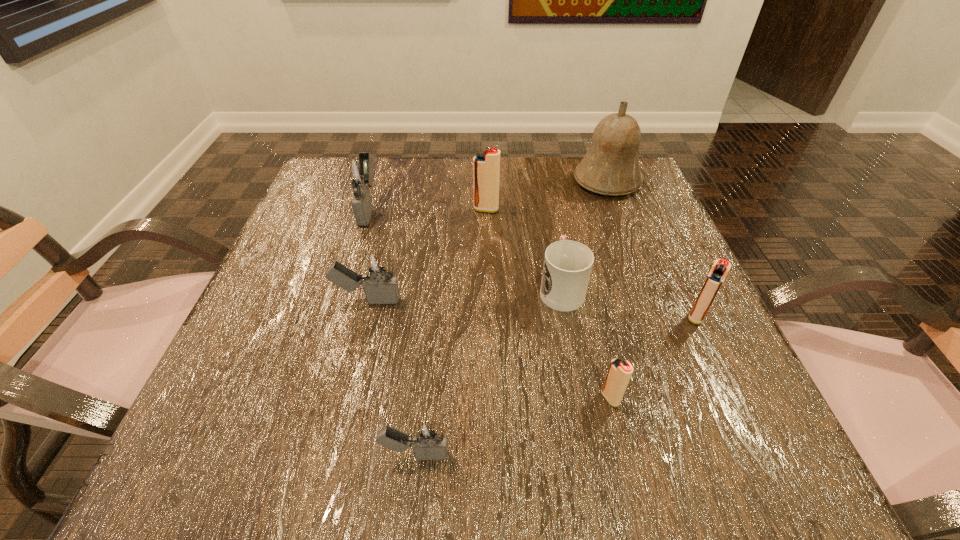
Where is `the sixth closest object to the second biggest gray igniter`? the sixth closest object to the second biggest gray igniter is located at coordinates (610, 167).

Where is `object that can be found as the third closest to the biggest gray igniter`? This screenshot has height=540, width=960. object that can be found as the third closest to the biggest gray igniter is located at coordinates (567, 266).

Locate an element on the screen. This screenshot has width=960, height=540. igniter that is the closest one to the farthest red igniter is located at coordinates (356, 172).

Select which igniter appears as the fourth closest to the second nearest object. Please provide its 2D coordinates. Your answer should be formatted as a tuple, i.e. [(x, y)], where the tuple contains the x and y coordinates of a point satisfying the conditions above.

[(486, 166)]

Select which red igniter is the closest to the red cup. Please provide its 2D coordinates. Your answer should be formatted as a tuple, i.e. [(x, y)], where the tuple contains the x and y coordinates of a point satisfying the conditions above.

[(619, 373)]

At what (x,y) coordinates should I click in order to perform the action: click on red igniter that is the second closest to the bell. Please return your answer as a coordinate pair (x, y). Looking at the image, I should click on (721, 267).

Locate an element on the screen. Image resolution: width=960 pixels, height=540 pixels. the second closest gray igniter to the third igniter from right to left is located at coordinates (381, 287).

Select which gray igniter is the third closest to the bell. Please provide its 2D coordinates. Your answer should be formatted as a tuple, i.e. [(x, y)], where the tuple contains the x and y coordinates of a point satisfying the conditions above.

[(428, 439)]

Find the location of a particular element. The width and height of the screenshot is (960, 540). blank area in the image that satisfies the following two spatial constraints: 1. on the back side of the farthest gray igniter; 2. on the left side of the tallest object is located at coordinates (377, 181).

You are a GUI agent. You are given a task and a screenshot of the screen. Output one action in this format:
    pyautogui.click(x=<x>, y=<y>)
    Task: Click on the vacant region that satisfies the following two spatial constraints: 1. on the front side of the rightmost red igniter; 2. on the right side of the leftmost red igniter
    
    Given the screenshot: What is the action you would take?
    pyautogui.click(x=488, y=316)